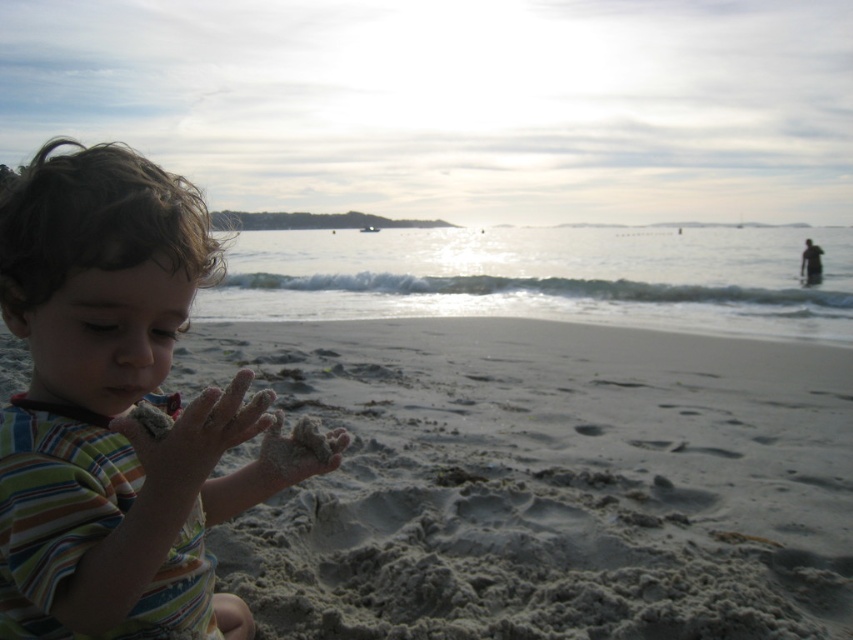
Question: Can you confirm if fine-grained sand at lower center is positioned above striped cotton shirt at left?

Choices:
 (A) yes
 (B) no

Answer: (B)

Question: Is sandy skin hand at lower left further to camera compared to sandy beige hand at lower center?

Choices:
 (A) no
 (B) yes

Answer: (A)

Question: Which object appears farthest from the camera in this image?

Choices:
 (A) sandy skin hand at lower left
 (B) fine-grained sand at lower center

Answer: (B)

Question: Among these points, which one is farthest from the camera?

Choices:
 (A) (502, 429)
 (B) (83, 355)

Answer: (A)

Question: From the image, what is the correct spatial relationship of fine-grained sand at lower center in relation to sandy beige hand at lower center?

Choices:
 (A) above
 (B) below

Answer: (B)

Question: Among these points, which one is nearest to the camera?

Choices:
 (A) (244, 372)
 (B) (253, 593)
 (C) (317, 451)
 (D) (27, 216)

Answer: (A)